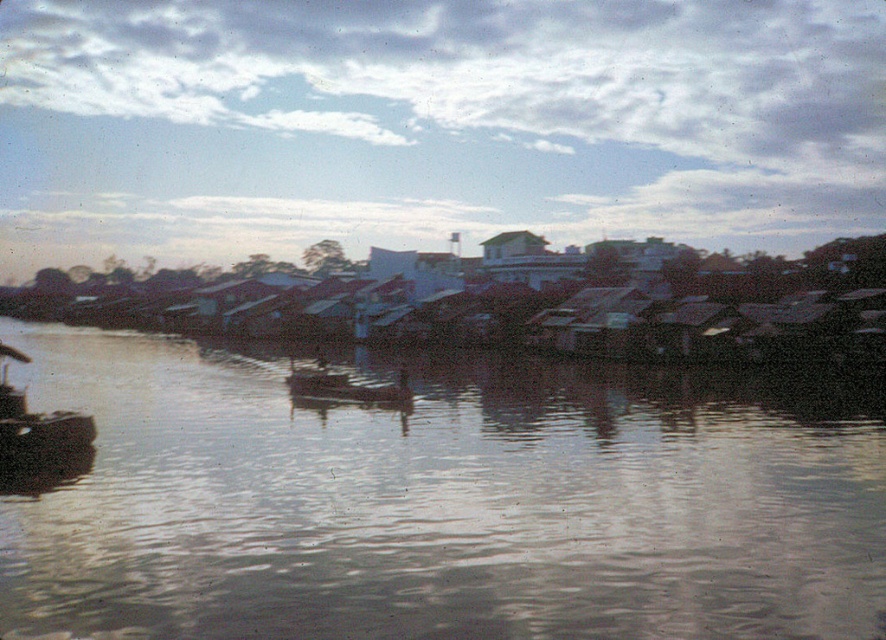
You are standing on the riverside and want to cross to the other side. The wooden boat at lower left is anchored near the shore. Can you use the brown matte water at center to reach the boat?

The brown matte water at center is shorter than the wooden boat at lower left, meaning the water level is lower than the boat. This suggests the boat is above the water, so you can board the wooden boat at lower left from the shore.

You are an observer standing at the riverside. You see two wooden boats in the image. Which boat, the wooden boat at lower left or the wooden boat at center, is taller?

The wooden boat at lower left is much taller than the wooden boat at center.